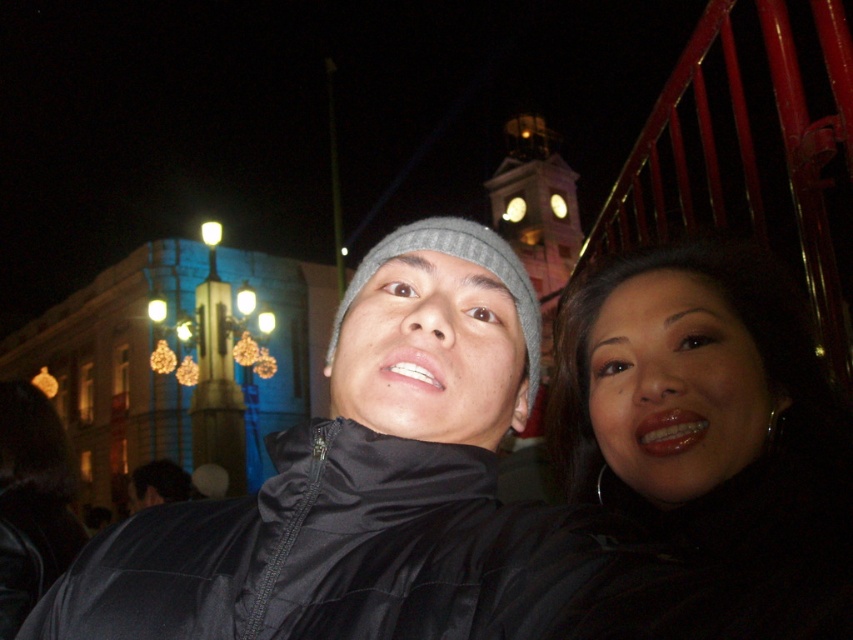
You are a photographer trying to capture the two people in the image. The black matte jacket at center and the matte black jacket at lower right are both visible in your frame. Based on their positions, which jacket is closer to the bottom edge of the photo?

The black matte jacket at center is below matte black jacket at lower right, so the black matte jacket at center is closer to the bottom edge of the photo.

You are a photographer trying to focus on the black matte jacket at center in the image. What are the coordinates where you should aim your camera?

The coordinates for the black matte jacket at center are at point (334, 454).